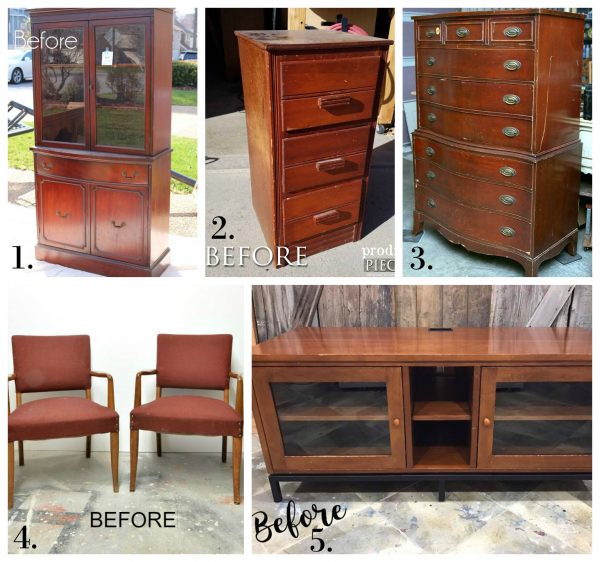
Locate an element on the screen. small wooden china cabinet is located at coordinates (117, 190).